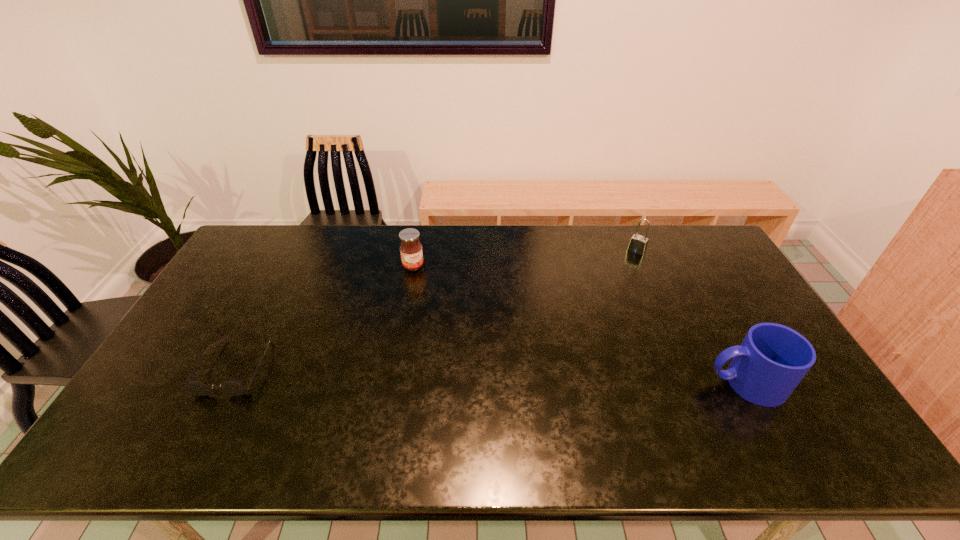
This screenshot has height=540, width=960. I want to click on the leftmost object, so click(234, 387).

What are the coordinates of `the shortest object` in the screenshot? It's located at 234,387.

Find the location of `mug`. mug is located at coordinates (772, 360).

At what (x,y) coordinates should I click in order to perform the action: click on the second object from left to right. Please return your answer as a coordinate pair (x, y). The image size is (960, 540). Looking at the image, I should click on (411, 253).

The image size is (960, 540). I want to click on jam, so click(411, 253).

The width and height of the screenshot is (960, 540). Identify the location of padlock. (638, 244).

Identify the location of vacant space located 0.140m on the side with the handle of the mug. (654, 383).

You are a GUI agent. You are given a task and a screenshot of the screen. Output one action in this format:
    pyautogui.click(x=<x>, y=<y>)
    Task: Click on the free space located 0.110m on the side with the handle of the mug
    Image resolution: width=960 pixels, height=540 pixels.
    Given the screenshot: What is the action you would take?
    pyautogui.click(x=664, y=383)

Locate an element on the screen. Image resolution: width=960 pixels, height=540 pixels. blank space located 0.080m on the side with the handle of the mug is located at coordinates (676, 383).

At what (x,y) coordinates should I click in order to perform the action: click on free region located on the label side of the second farthest object. Please return your answer as a coordinate pair (x, y). This screenshot has height=540, width=960. Looking at the image, I should click on (461, 339).